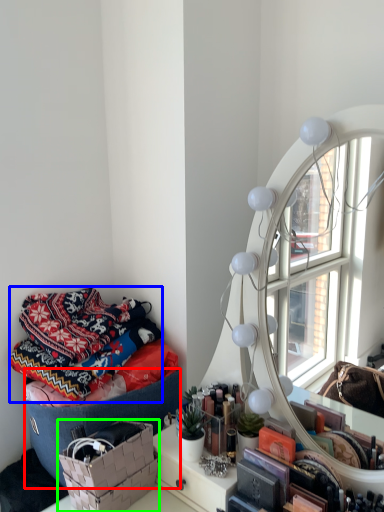
Question: Based on their relative distances, which object is nearer to storage box (highlighted by a red box)? Choose from blanket (highlighted by a blue box) and basket (highlighted by a green box).

Choices:
 (A) blanket
 (B) basket

Answer: (B)